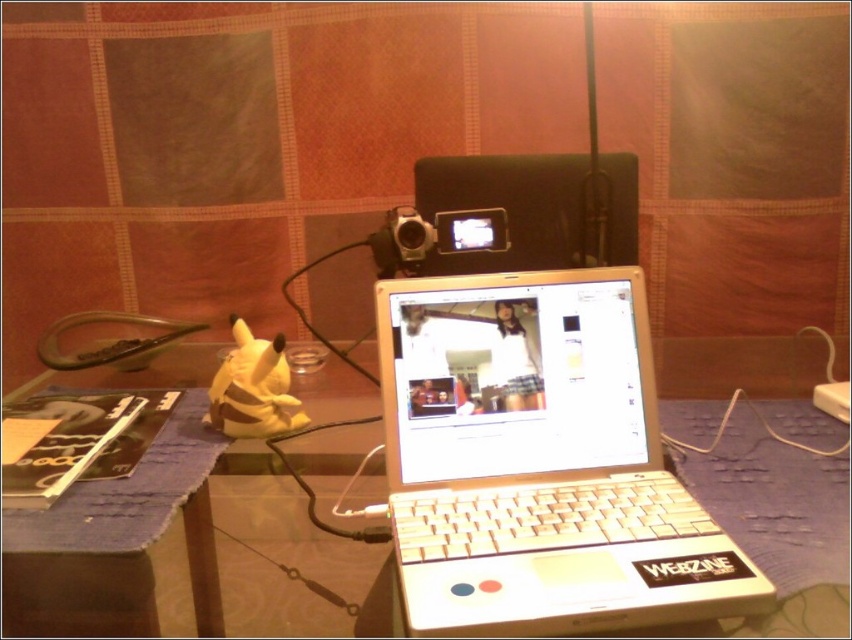
Between white plastic laptop at center and sleek black video camera at center, which one appears on the right side from the viewer's perspective?

white plastic laptop at center

Which is in front, point (620, 401) or point (395, 250)?

Point (620, 401) is more forward.

The width and height of the screenshot is (852, 640). Find the location of `white plastic laptop at center`. white plastic laptop at center is located at coordinates (539, 461).

Is blue fabric table at center smaller than sleek black video camera at center?

No, blue fabric table at center is not smaller than sleek black video camera at center.

Is blue fabric table at center taller than sleek black video camera at center?

Correct, blue fabric table at center is much taller as sleek black video camera at center.

The width and height of the screenshot is (852, 640). In order to click on blue fabric table at center in this screenshot , I will do `click(283, 516)`.

Between point (491, 339) and point (372, 371), which one is positioned behind?

Point (372, 371)

Is white plastic laptop at center wider than blue fabric table at center?

No.

The width and height of the screenshot is (852, 640). In order to click on white plastic laptop at center in this screenshot , I will do `click(539, 461)`.